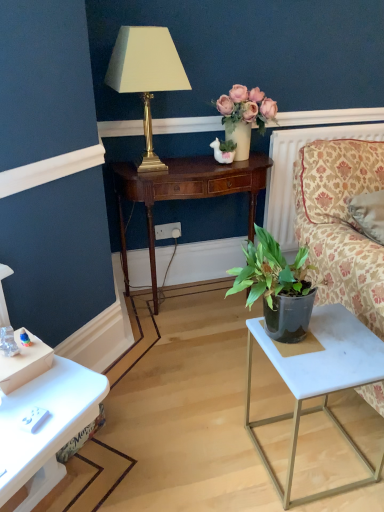
Where is `empty space that is ontop of white marble side table at lower right (from a real-world perspective)`? empty space that is ontop of white marble side table at lower right (from a real-world perspective) is located at coordinates (332, 353).